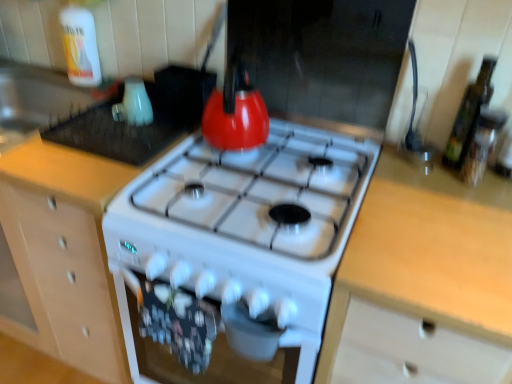
Question: Is green glass bottle at right, which is counted as the first bottle, starting from the front, to the left or to the right of light wood countertop at right in the image?

Choices:
 (A) left
 (B) right

Answer: (B)

Question: Is green glass bottle at right, the 1th bottle viewed from the right, spatially inside light wood countertop at right, or outside of it?

Choices:
 (A) outside
 (B) inside

Answer: (A)

Question: Estimate the real-world distances between objects in this image. Which object is farther from the translucent plastic bottle at upper left, which is counted as the 2th bottle, starting from the bottom?

Choices:
 (A) matte white kettle at upper left, marked as the 2th appliance in a left-to-right arrangement
 (B) light wood countertop at right
 (C) green glass bottle at right, the 1th bottle viewed from the right
 (D) white glossy kettle at upper left, placed as the 2th appliance when sorted from right to left
 (E) wooden cabinet at center

Answer: (C)

Question: Estimate the real-world distances between objects in this image. Which object is closer to the light wood countertop at right?

Choices:
 (A) green glass bottle at right, the second bottle viewed from the left
 (B) translucent plastic bottle at upper left, positioned as the 1th bottle in back-to-front order
 (C) wooden cabinet at center
 (D) matte white kettle at upper left, marked as the 2th appliance in a left-to-right arrangement
 (E) white glossy kettle at upper left, placed as the 2th appliance when sorted from right to left

Answer: (A)